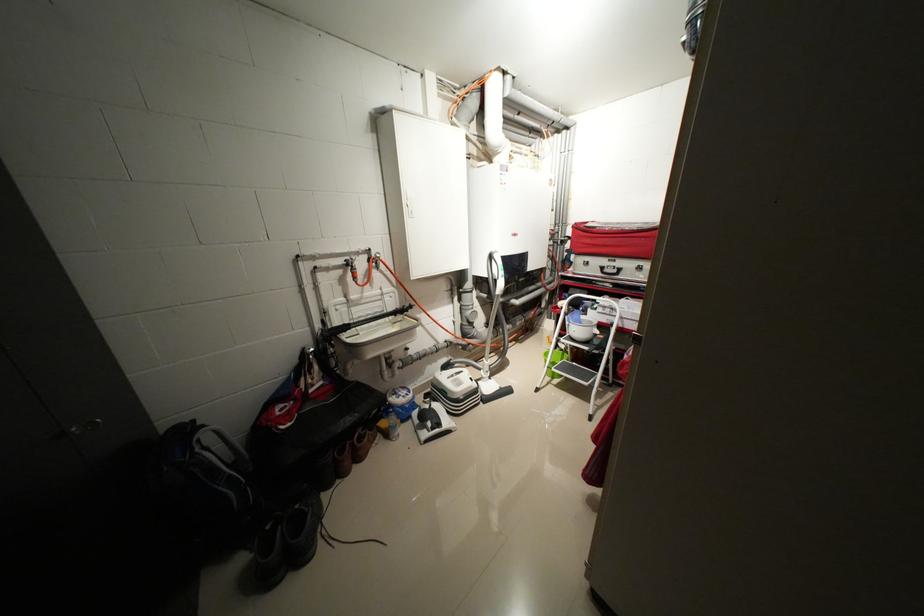
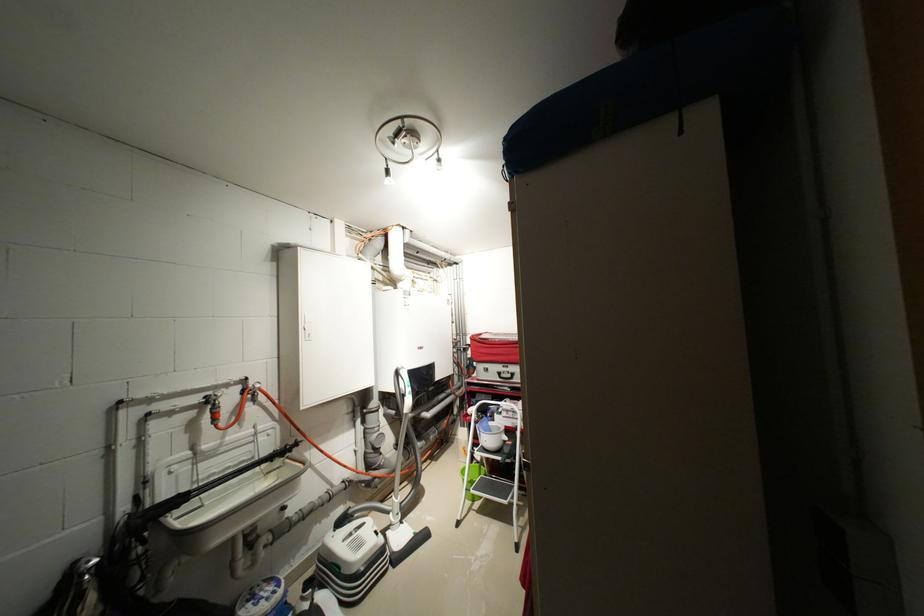
The point at (573, 315) is marked in the first image. Where is the corresponding point in the second image?

(482, 424)